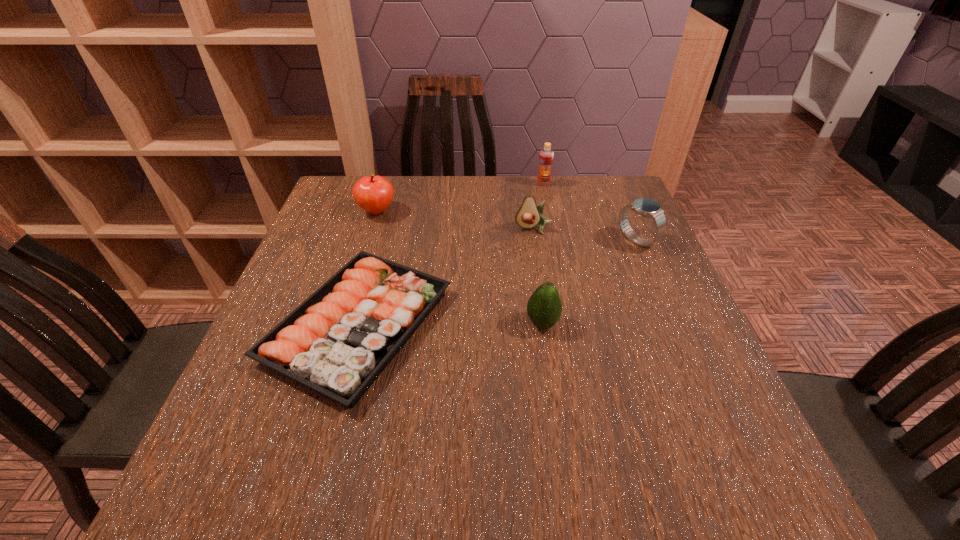
You are a GUI agent. You are given a task and a screenshot of the screen. Output one action in this format:
    pyautogui.click(x=<x>, y=<y>)
    Task: Click on the free area in between the shortest object and the orange juice
    This screenshot has height=540, width=960.
    Given the screenshot: What is the action you would take?
    pyautogui.click(x=451, y=254)

Locate an element on the screen. The height and width of the screenshot is (540, 960). free space between the farther avocado and the second farthest object is located at coordinates (455, 220).

Where is `free spot between the farthest object and the apple`? free spot between the farthest object and the apple is located at coordinates (460, 198).

Where is `vacant space in between the farther avocado and the nearer avocado`? This screenshot has height=540, width=960. vacant space in between the farther avocado and the nearer avocado is located at coordinates (538, 276).

Select which object appears as the second closest to the shortest object. Please provide its 2D coordinates. Your answer should be formatted as a tuple, i.e. [(x, y)], where the tuple contains the x and y coordinates of a point satisfying the conditions above.

[(373, 194)]

Select which object is the second closest to the shortest object. Please provide its 2D coordinates. Your answer should be formatted as a tuple, i.e. [(x, y)], where the tuple contains the x and y coordinates of a point satisfying the conditions above.

[(373, 194)]

This screenshot has width=960, height=540. I want to click on vacant space that satisfies the following two spatial constraints: 1. on the back side of the orange juice; 2. on the left side of the second farthest object, so click(x=386, y=184).

Locate an element on the screen. free space that satisfies the following two spatial constraints: 1. on the back side of the shortest object; 2. on the right side of the farthest object is located at coordinates (397, 184).

This screenshot has width=960, height=540. In order to click on vacant area in the image that satisfies the following two spatial constraints: 1. on the seed side of the watch; 2. on the right side of the farther avocado in this screenshot , I will do `click(536, 240)`.

This screenshot has width=960, height=540. What are the coordinates of `vacant space that satisfies the following two spatial constraints: 1. on the back side of the farthest object; 2. on the right side of the apple` in the screenshot? It's located at (386, 184).